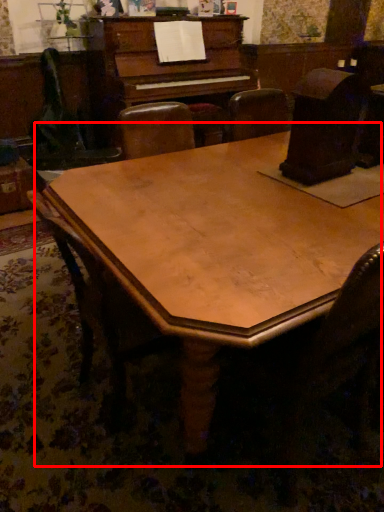
Question: Observing the image, what is the correct spatial positioning of table (annotated by the red box) in reference to chair?

Choices:
 (A) right
 (B) left

Answer: (A)